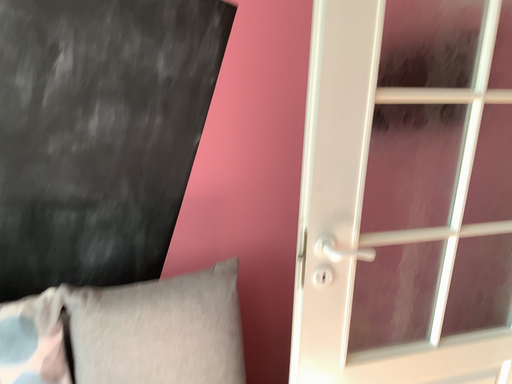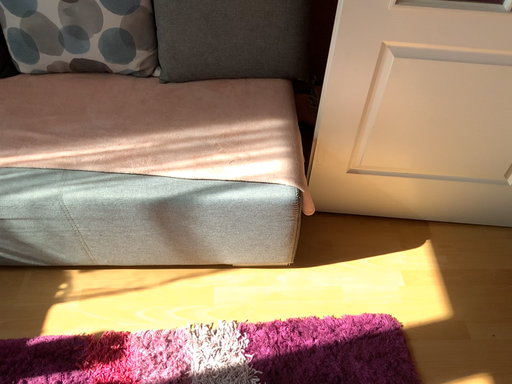
Question: Which way did the camera rotate in the video?

Choices:
 (A) rotated right
 (B) rotated left

Answer: (B)